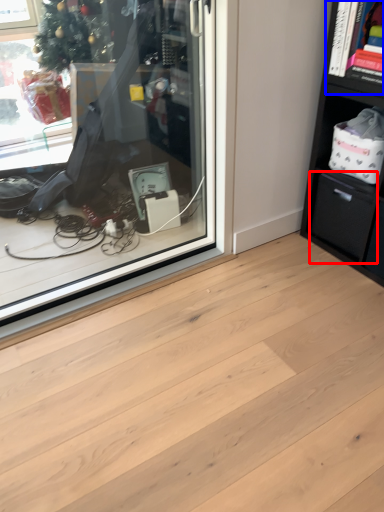
Question: Among these objects, which one is farthest to the camera, drawer (highlighted by a red box) or cabinet (highlighted by a blue box)?

Choices:
 (A) drawer
 (B) cabinet

Answer: (A)